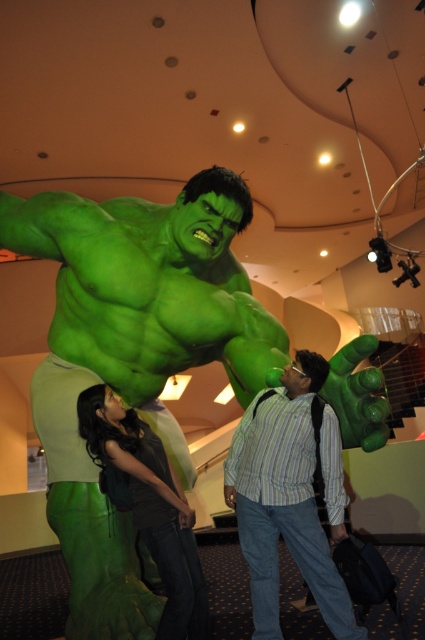
Question: Does green rubber statue at center appear on the left side of striped cotton shirt at center?

Choices:
 (A) no
 (B) yes

Answer: (B)

Question: Which of the following is the closest to the observer?

Choices:
 (A) (243, 284)
 (B) (333, 422)

Answer: (B)

Question: Is striped cotton shirt at center to the right of matte green costume at lower left from the viewer's perspective?

Choices:
 (A) no
 (B) yes

Answer: (B)

Question: Is striped cotton shirt at center to the left of matte green costume at lower left from the viewer's perspective?

Choices:
 (A) no
 (B) yes

Answer: (A)

Question: Considering the real-world distances, which object is farthest from the green rubber statue at center?

Choices:
 (A) matte green costume at lower left
 (B) striped cotton shirt at center

Answer: (B)

Question: Which object is farther from the camera taking this photo?

Choices:
 (A) green rubber statue at center
 (B) matte green costume at lower left

Answer: (A)